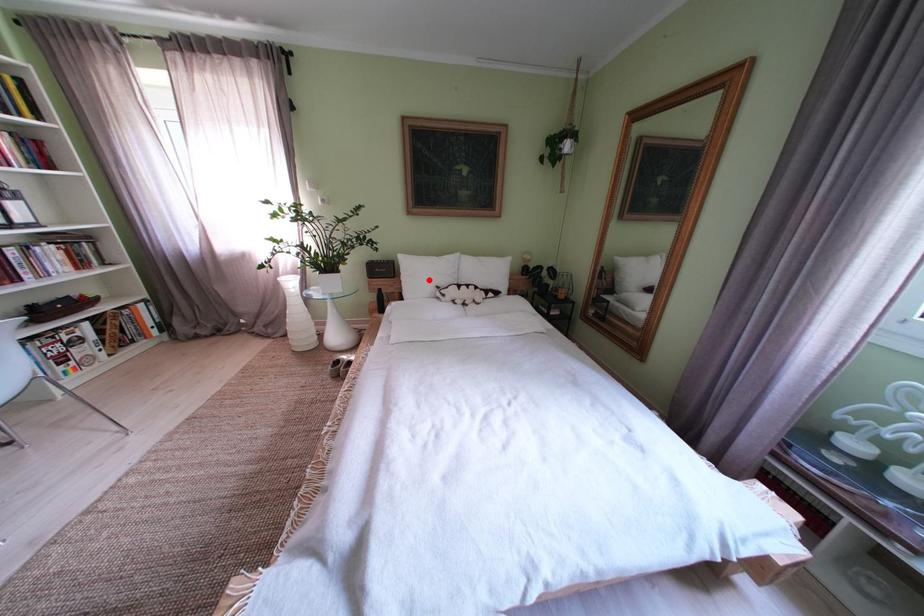
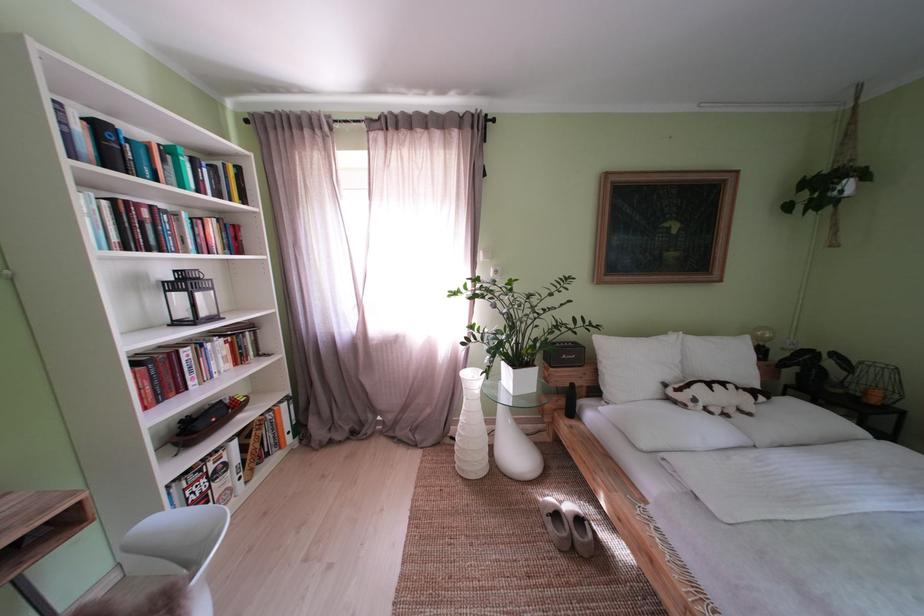
Question: I am providing you with two images of the same scene from different viewpoints. In image1, a red point is highlighted. Considering the same 3D point in image2, which of the following is correct?

Choices:
 (A) It is closer
 (B) It is farther

Answer: (B)